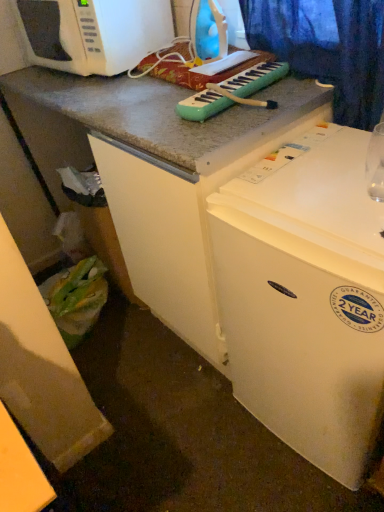
Where is `free location above teal plastic musical keyboard at center (from a real-world perspective)`? The image size is (384, 512). free location above teal plastic musical keyboard at center (from a real-world perspective) is located at coordinates (233, 80).